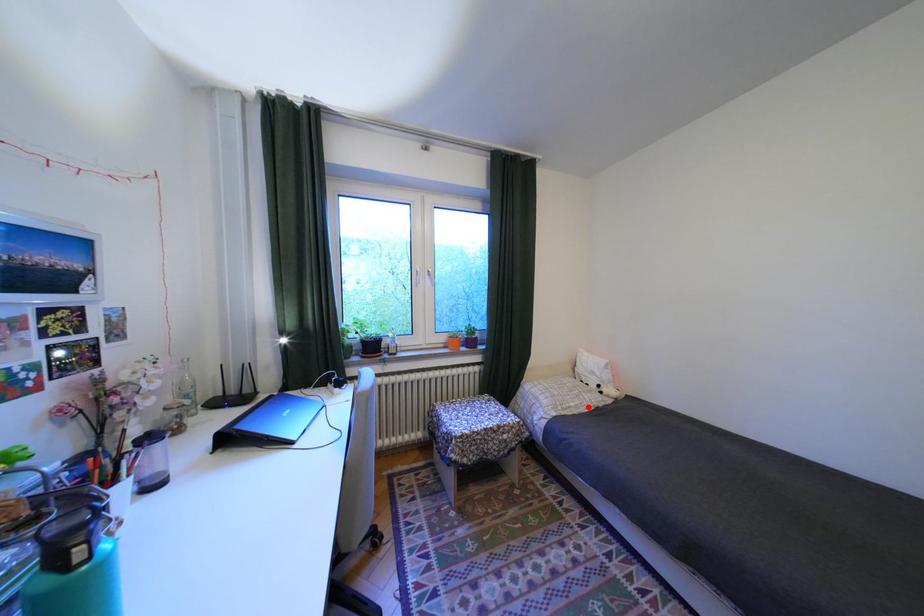
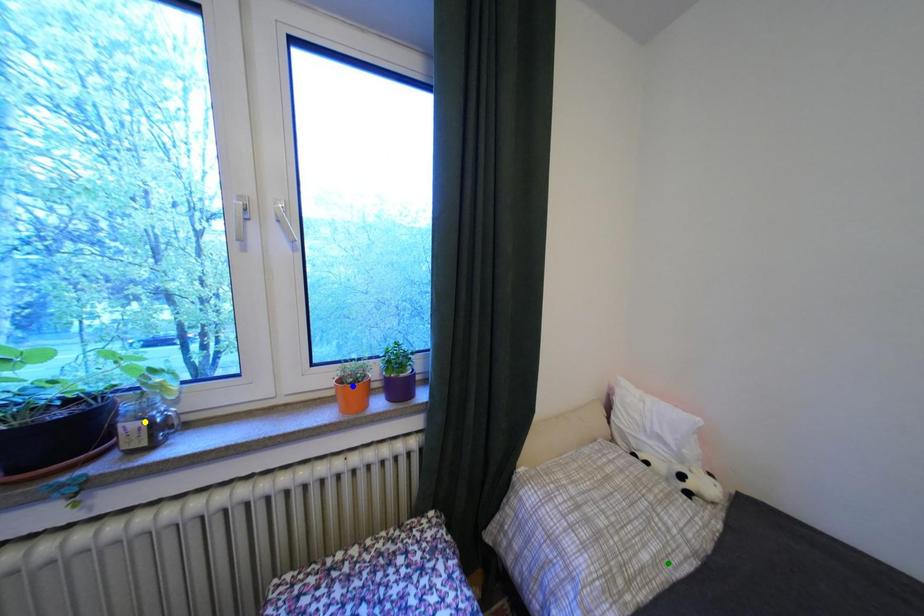
Question: I am providing you with two images of the same scene from different viewpoints. A red point is marked on the first image. You are given multiple points on the second image. Can you choose the point in image 2 that corresponds to the point in image 1?

Choices:
 (A) blue point
 (B) green point
 (C) yellow point

Answer: (B)